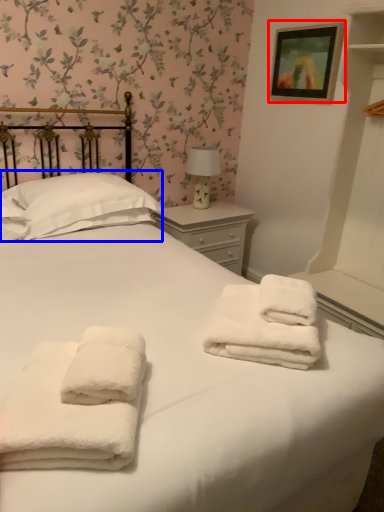
Question: Among these objects, which one is farthest to the camera, picture frame (highlighted by a red box) or pillow (highlighted by a blue box)?

Choices:
 (A) picture frame
 (B) pillow

Answer: (A)